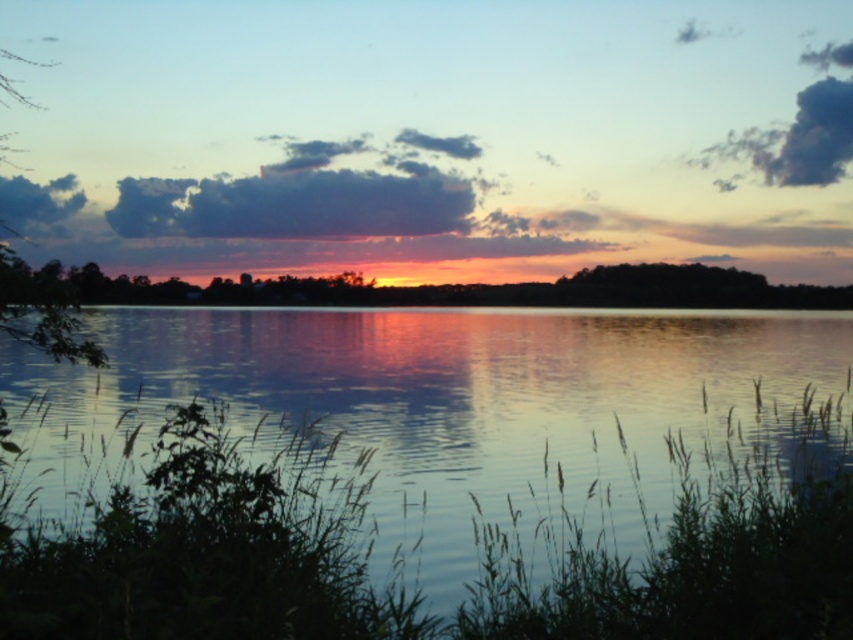
Question: Is silhouette tree at center thinner than dark gray fluffy cloud at upper center?

Choices:
 (A) yes
 (B) no

Answer: (B)

Question: Which is nearer to the silhouette tree at center?

Choices:
 (A) dark gray cloud at upper left
 (B) blue reflective water at center
 (C) green leafy tree at left

Answer: (B)

Question: Is dark gray fluffy cloud at upper center smaller than green leafy tree at left?

Choices:
 (A) yes
 (B) no

Answer: (A)

Question: Which object appears closest to the camera in this image?

Choices:
 (A) blue reflective water at center
 (B) dark gray cloud at upper left
 (C) silhouette tree at center
 (D) green leafy tree at left

Answer: (A)

Question: Does dark gray fluffy cloud at upper center appear under dark gray cloud at upper left?

Choices:
 (A) yes
 (B) no

Answer: (A)

Question: Which point is farther from the camera taking this photo?

Choices:
 (A) 184,609
 (B) 428,289
 (C) 177,193
 (D) 90,344

Answer: (C)